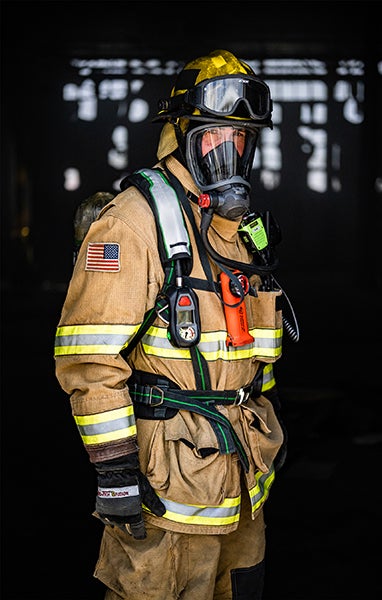
In order to click on air sensor in this screenshot , I will do [x=184, y=332], [x=189, y=324].